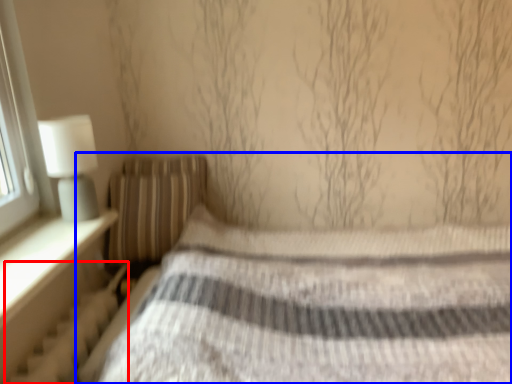
Question: Which of the following is the farthest to the observer, radiator (highlighted by a red box) or bed (highlighted by a blue box)?

Choices:
 (A) radiator
 (B) bed

Answer: (A)